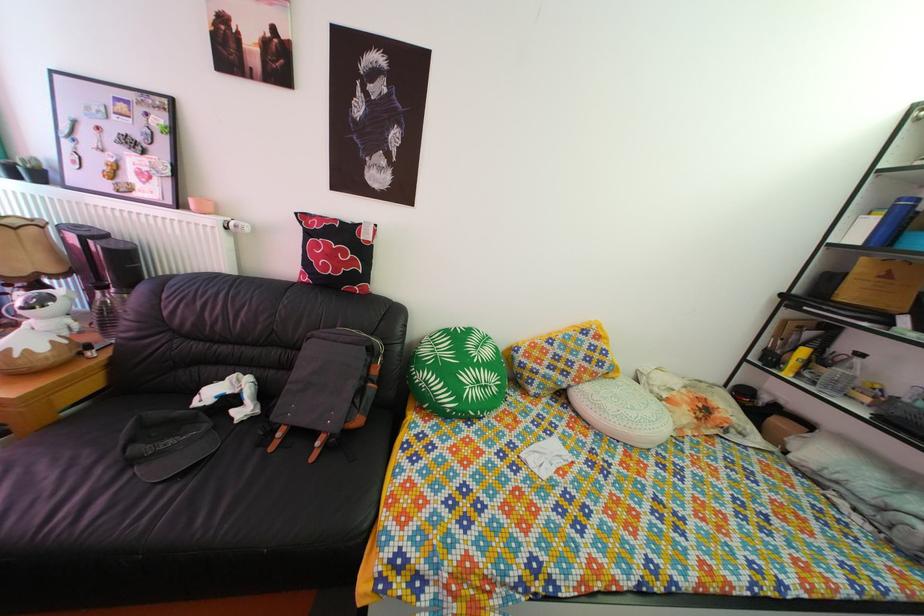
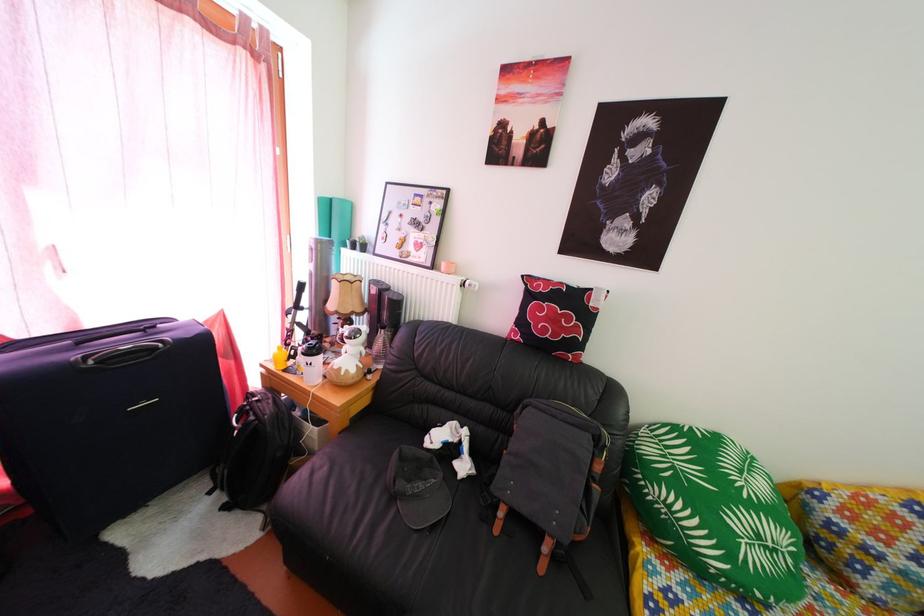
Question: The images are taken continuously from a first-person perspective. In which direction are you moving?

Choices:
 (A) Left
 (B) Right
 (C) Forward
 (D) Backward

Answer: (A)